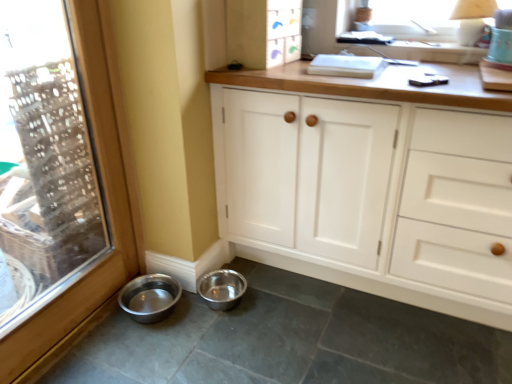
Where is `vacant space to the right of metallic silver bowl at lower left, which is counted as the first basin, starting from the left`? This screenshot has height=384, width=512. vacant space to the right of metallic silver bowl at lower left, which is counted as the first basin, starting from the left is located at coordinates (197, 313).